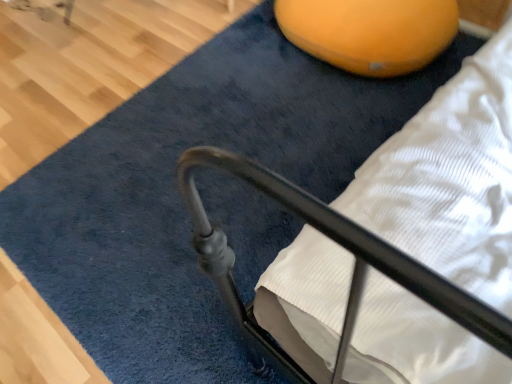
Measure the distance between matte orange cushion at upper right and camera.

5.28 feet.

Identify the location of matte orange cushion at upper right. The width and height of the screenshot is (512, 384). (370, 32).

Describe the element at coordinates (370, 32) in the screenshot. The width and height of the screenshot is (512, 384). I see `matte orange cushion at upper right` at that location.

I want to click on matte orange cushion at upper right, so click(x=370, y=32).